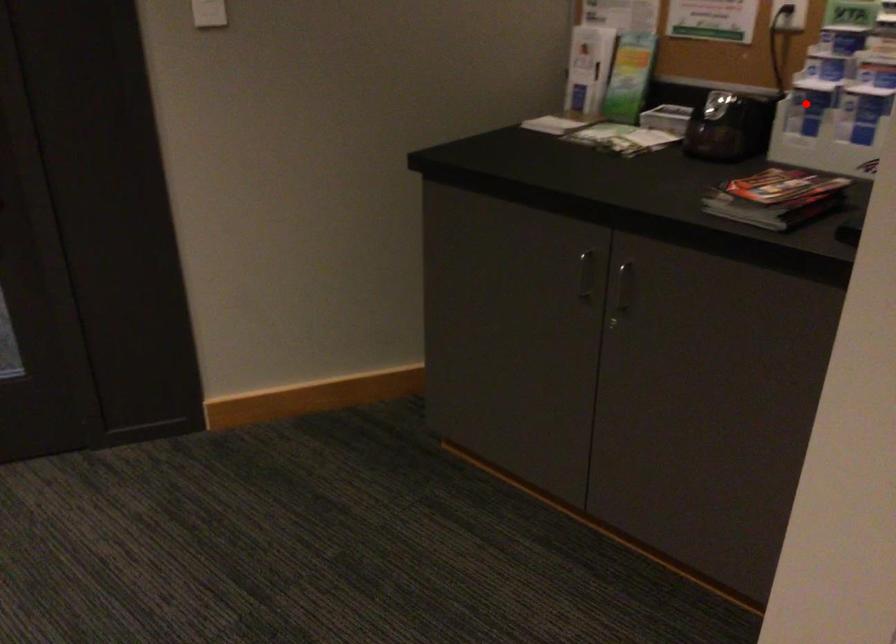
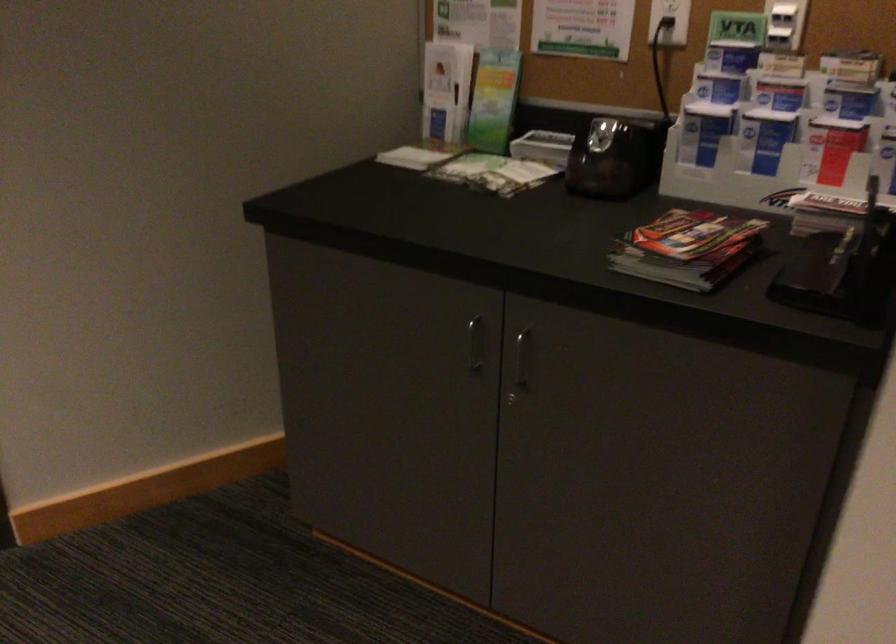
Question: I am providing you with two images of the same scene from different viewpoints. A red point is marked on the first image. Is the red point's position out of view in image 2?

Choices:
 (A) Yes
 (B) No

Answer: (B)